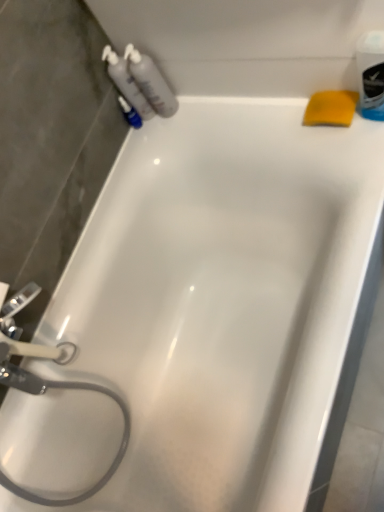
Question: In terms of size, does translucent plastic bottles at upper left, which is counted as the 1th cleaning product, starting from the left, appear bigger or smaller than translucent plastic bottles at upper left, positioned as the first cleaning product in right-to-left order?

Choices:
 (A) big
 (B) small

Answer: (B)

Question: In terms of width, does translucent plastic bottles at upper left, which is counted as the 1th cleaning product, starting from the left, look wider or thinner when compared to translucent plastic bottles at upper left, acting as the second cleaning product starting from the left?

Choices:
 (A) thin
 (B) wide

Answer: (B)

Question: Which is nearer to the blue plastic mouthwash at upper right?

Choices:
 (A) yellow sponge at upper right
 (B) translucent plastic bottles at upper left, acting as the second cleaning product starting from the left
 (C) translucent plastic bottles at upper left, which is the 2th cleaning product in right-to-left order

Answer: (A)

Question: Based on their relative distances, which object is farther from the translucent plastic bottles at upper left, acting as the second cleaning product starting from the left?

Choices:
 (A) translucent plastic bottles at upper left, which is the 2th cleaning product in right-to-left order
 (B) yellow sponge at upper right
 (C) blue plastic mouthwash at upper right

Answer: (C)